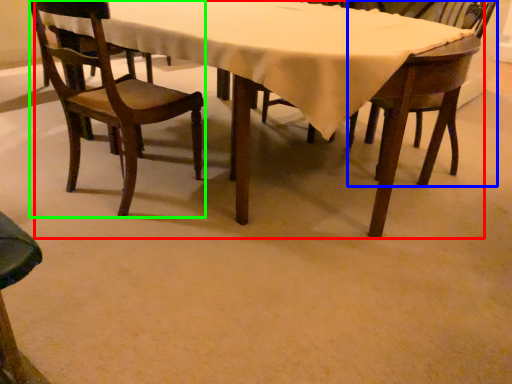
Question: Which is farther away from kitchen & dining room table (highlighted by a red box)? chair (highlighted by a blue box) or chair (highlighted by a green box)?

Choices:
 (A) chair
 (B) chair

Answer: (A)